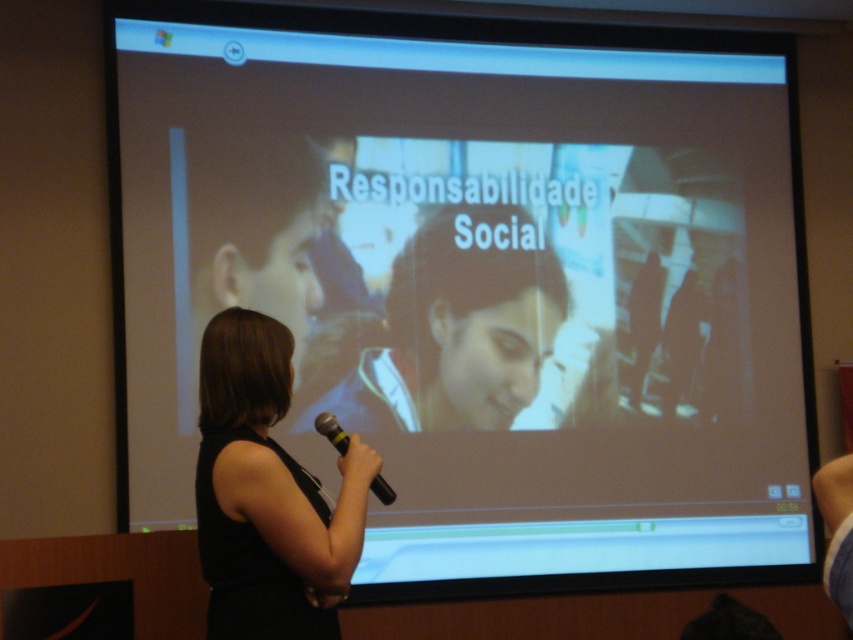
Consider the image. Measure the distance between black fabric at center and camera.

They are 6.45 feet apart.

Is black fabric at center wider than yellow rubber microphone at center?

Yes.

The height and width of the screenshot is (640, 853). In order to click on black fabric at center in this screenshot , I will do `click(267, 493)`.